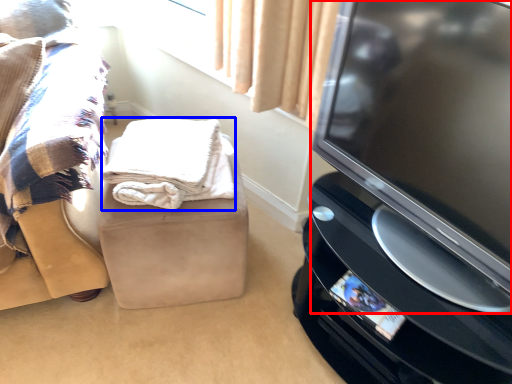
Question: Which of the following is the closest to the observer, television (highlighted by a red box) or blanket (highlighted by a blue box)?

Choices:
 (A) television
 (B) blanket

Answer: (A)